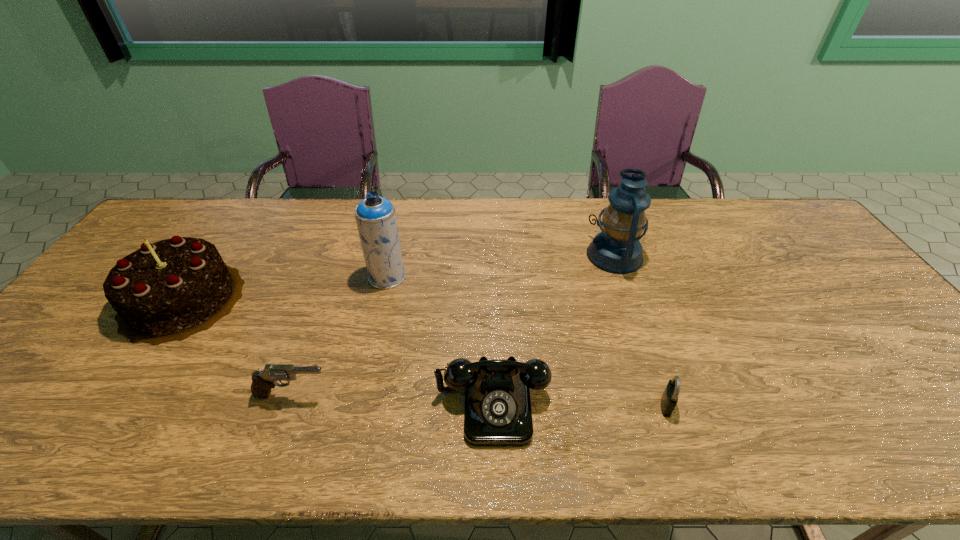
Identify which object is the fifth closest to the leftmost object. Please provide its 2D coordinates. Your answer should be formatted as a tuple, i.e. [(x, y)], where the tuple contains the x and y coordinates of a point satisfying the conditions above.

[(669, 399)]

Select which object appears as the closest to the pistol. Please provide its 2D coordinates. Your answer should be formatted as a tuple, i.e. [(x, y)], where the tuple contains the x and y coordinates of a point satisfying the conditions above.

[(166, 291)]

I want to click on free location that satisfies the following two spatial constraints: 1. on the face of the padlock; 2. on the left side of the lantern, so pos(666,405).

I want to click on free space in the image that satisfies the following two spatial constraints: 1. on the face of the padlock; 2. on the right side of the lantern, so click(x=666, y=405).

The height and width of the screenshot is (540, 960). In order to click on free location that satisfies the following two spatial constraints: 1. on the face of the lantern; 2. on the back side of the padlock in this screenshot , I will do `click(666, 405)`.

I want to click on vacant area that satisfies the following two spatial constraints: 1. on the face of the lantern; 2. on the back side of the shortest object, so click(x=666, y=405).